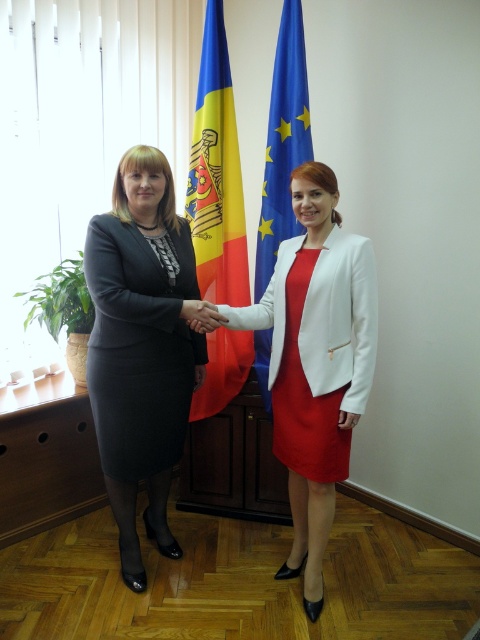
Who is taller, blue fabric flag at center or matte black hand at center?

blue fabric flag at center is taller.

Which is more to the left, blue fabric flag at center or matte black hand at center?

matte black hand at center is more to the left.

Based on the photo, who is more forward, (292, 147) or (202, 314)?

Positioned in front is point (202, 314).

You are a GUI agent. You are given a task and a screenshot of the screen. Output one action in this format:
    pyautogui.click(x=<x>, y=<y>)
    Task: Click on the blue fabric flag at center
    
    Given the screenshot: What is the action you would take?
    pyautogui.click(x=283, y=141)

Between matte black skirt at left and white matte blazer at center, which one is positioned higher?

Positioned higher is white matte blazer at center.

Who is more forward, (x=108, y=460) or (x=347, y=346)?

Point (x=347, y=346) is more forward.

Is point (168, 474) behind point (332, 230)?

Yes, it is.

At what (x,y) coordinates should I click in order to perform the action: click on matte black skirt at left. Please return your answer as a coordinate pair (x, y). This screenshot has height=640, width=480. Looking at the image, I should click on (141, 346).

This screenshot has width=480, height=640. Describe the element at coordinates (340, 320) in the screenshot. I see `white matte blazer at center` at that location.

Looking at this image, between white matte blazer at center and blue fabric flag at center, which one is positioned higher?

blue fabric flag at center

This screenshot has width=480, height=640. What do you see at coordinates (340, 320) in the screenshot?
I see `white matte blazer at center` at bounding box center [340, 320].

Locate an element on the screen. white matte blazer at center is located at coordinates (340, 320).